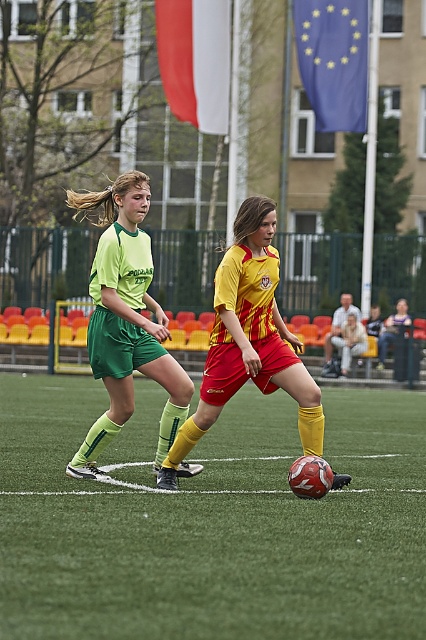
Question: Which point is closer to the camera?

Choices:
 (A) yellow/red striped jersey at center
 (B) blue fabric flag at upper center
 (C) white fabric flag at upper center
 (D) matte green shorts at center

Answer: (A)

Question: Which object is positioned farthest from the green artificial turf at center?

Choices:
 (A) yellow/red striped jersey at center
 (B) matte green shorts at center

Answer: (B)

Question: Does matte green shorts at center appear under blue fabric flag at upper center?

Choices:
 (A) no
 (B) yes

Answer: (B)

Question: Which is nearer to the white fabric flag at upper center?

Choices:
 (A) green artificial turf at center
 (B) matte green shorts at center
 (C) blue fabric flag at upper center
 (D) yellow/red striped jersey at center

Answer: (C)

Question: Is matte green shorts at center to the right of white fabric flag at upper center from the viewer's perspective?

Choices:
 (A) yes
 (B) no

Answer: (B)

Question: Is matte green shorts at center behind blue fabric flag at upper center?

Choices:
 (A) yes
 (B) no

Answer: (B)